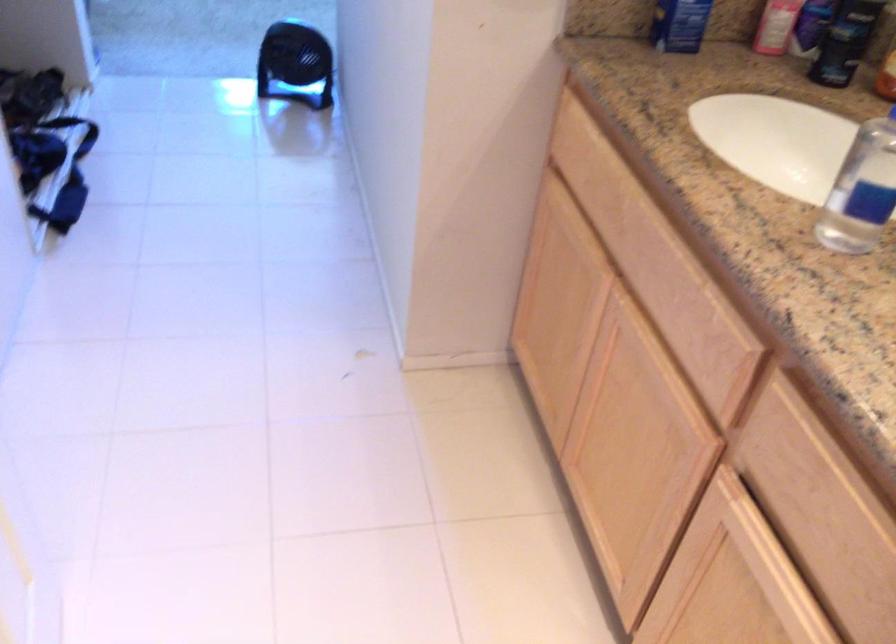
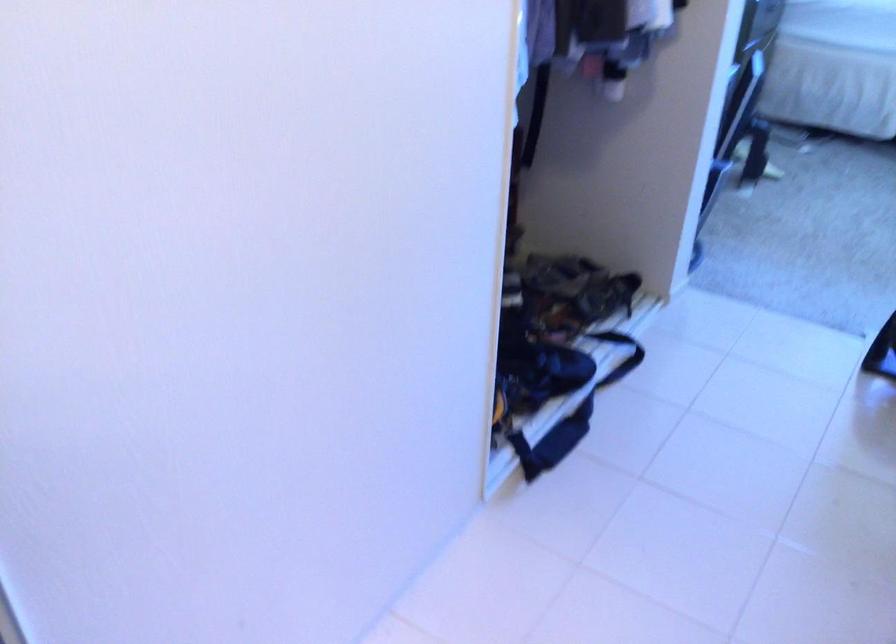
Question: The first image is from the beginning of the video and the second image is from the end. How did the camera likely rotate when shooting the video?

Choices:
 (A) Left
 (B) Right
 (C) Up
 (D) Down

Answer: (A)